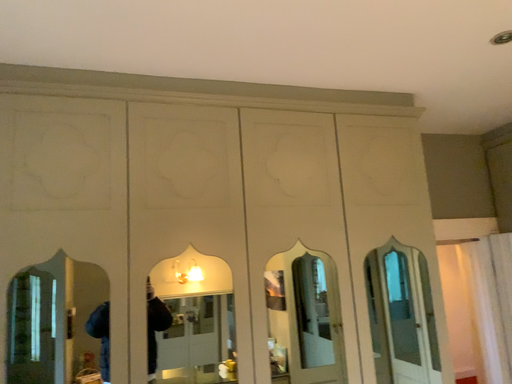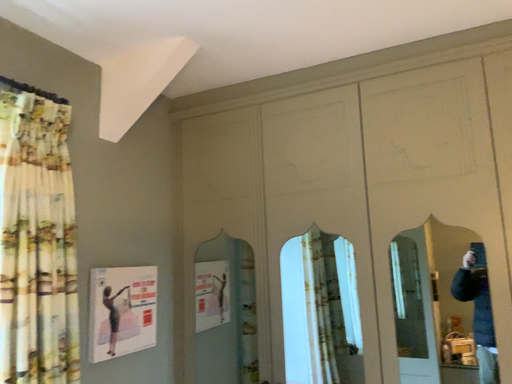
Question: Which way did the camera rotate in the video?

Choices:
 (A) rotated right
 (B) rotated left

Answer: (B)